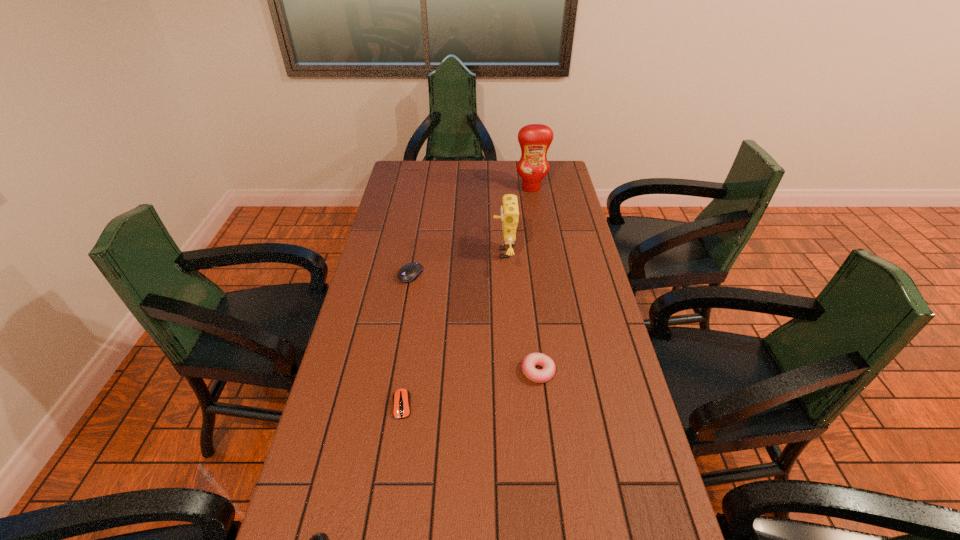
The image size is (960, 540). Identify the location of object that ranks as the fourth closest to the leftmost computer mouse. (509, 210).

At what (x,y) coordinates should I click in order to perform the action: click on computer mouse that is the closest one to the tallest object. Please return your answer as a coordinate pair (x, y). Looking at the image, I should click on (409, 272).

At what (x,y) coordinates should I click in order to perform the action: click on computer mouse identified as the closest to the second nearest object. Please return your answer as a coordinate pair (x, y). This screenshot has height=540, width=960. Looking at the image, I should click on (319, 539).

Where is `vacant space that satisfies the following two spatial constraints: 1. on the back side of the second farthest computer mouse; 2. on the left side of the doughnut`? The height and width of the screenshot is (540, 960). vacant space that satisfies the following two spatial constraints: 1. on the back side of the second farthest computer mouse; 2. on the left side of the doughnut is located at coordinates (407, 372).

I want to click on vacant area in the image that satisfies the following two spatial constraints: 1. on the label side of the farthest object; 2. on the face of the second tallest object, so click(542, 253).

Locate an element on the screen. The width and height of the screenshot is (960, 540). vacant space that satisfies the following two spatial constraints: 1. on the front side of the tallest computer mouse; 2. on the right side of the doughnut is located at coordinates (394, 372).

Identify the location of vacant space that satisfies the following two spatial constraints: 1. on the front side of the farthest computer mouse; 2. on the left side of the fifth farthest object. point(388,404).